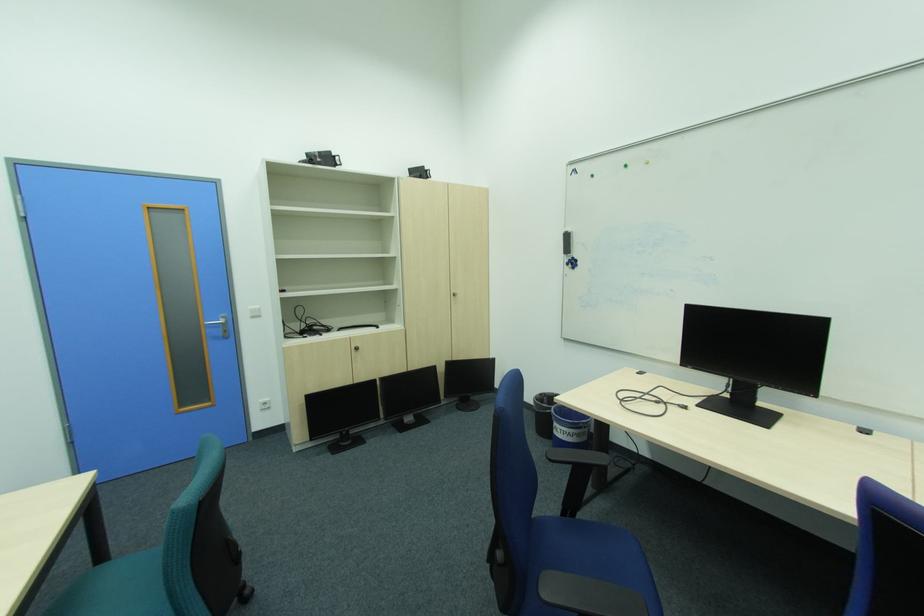
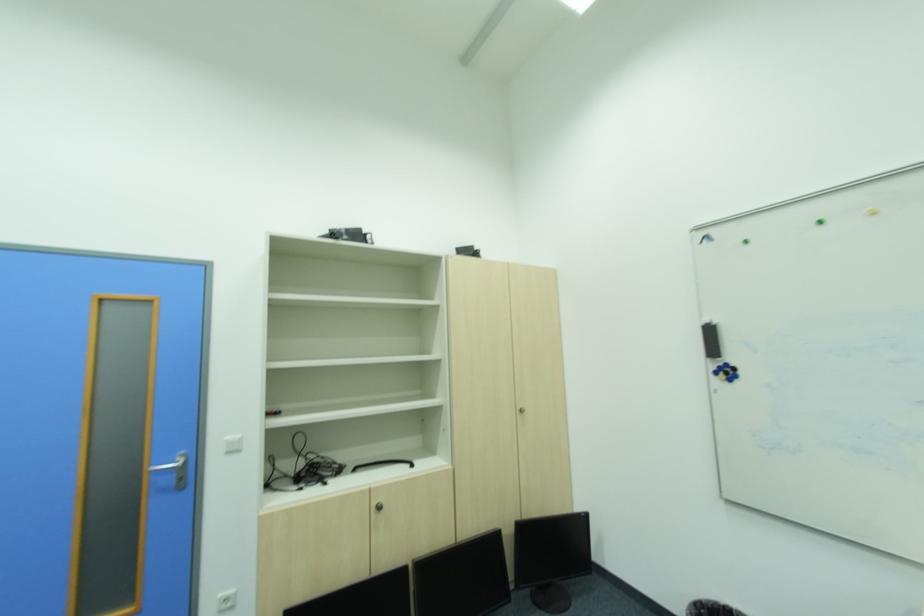
The point at (458, 365) is marked in the first image. Where is the corresponding point in the second image?

(531, 531)